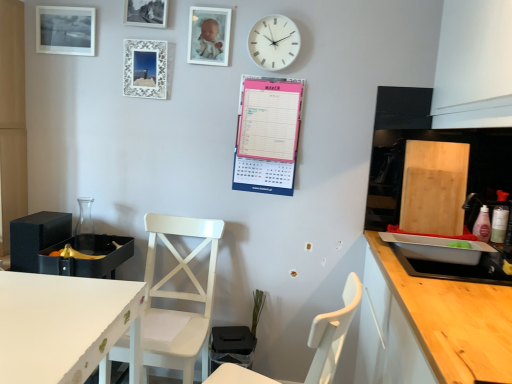
Question: Is white wooden chair at center, acting as the first chair starting from the front, wider or thinner than metallic silver picture frame at upper center, the second picture frame in the right-to-left sequence?

Choices:
 (A) wide
 (B) thin

Answer: (A)

Question: Relative to metallic silver picture frame at upper center, which is the third picture frame from left to right, is white wooden chair at center, acting as the first chair starting from the front, in front or behind?

Choices:
 (A) behind
 (B) front

Answer: (B)

Question: Estimate the real-world distances between objects in this image. Which object is closer to the wooden countertop at right?

Choices:
 (A) white lace picture frame at upper center, the 2th picture frame viewed from the left
 (B) white matte chair at center, placed as the first chair when sorted from back to front
 (C) white glossy picture frame at upper center, which is the first picture frame in right-to-left order
 (D) pink paperboard at upper center
 (E) metallic silver picture frame at upper center, which is the third picture frame from left to right

Answer: (D)

Question: Which object is positioned farthest from the white matte table at lower left?

Choices:
 (A) white lace picture frame at upper center, the 2th picture frame viewed from the left
 (B) white matte chair at center, which is counted as the 2th chair, starting from the front
 (C) pink paperboard at upper center
 (D) white glossy picture frame at upper center, which ranks as the fourth picture frame in left-to-right order
 (E) matte black picture frame at upper left, the fourth picture frame in the right-to-left sequence

Answer: (E)